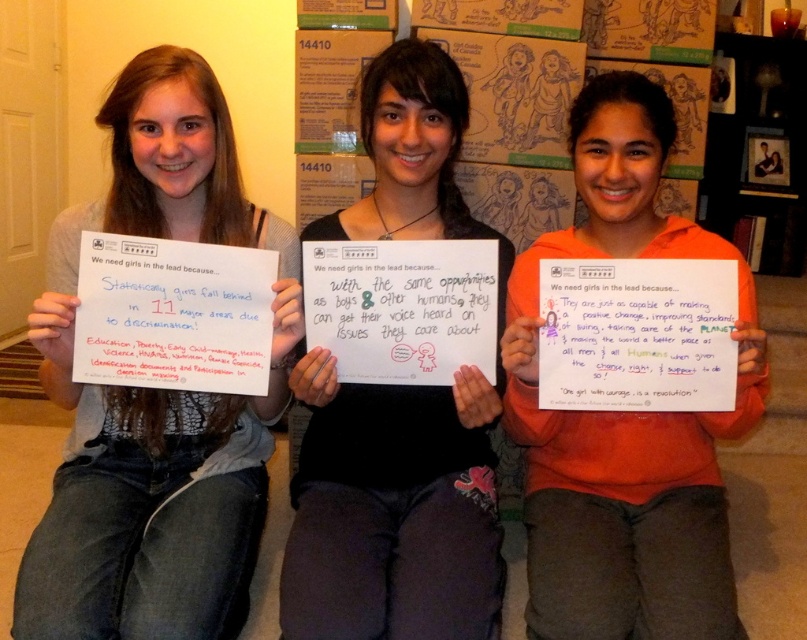
Question: Is white paper at center thinner than orange cotton shirt at center?

Choices:
 (A) yes
 (B) no

Answer: (A)

Question: Which point is closer to the camera?

Choices:
 (A) (534, 561)
 (B) (42, 307)

Answer: (B)

Question: Does gray sweater at center appear over white paper at center?

Choices:
 (A) yes
 (B) no

Answer: (B)

Question: Which object is positioned closest to the gray sweater at center?

Choices:
 (A) white paper at center
 (B) orange cotton shirt at center

Answer: (A)

Question: Does gray sweater at center lie in front of orange cotton shirt at center?

Choices:
 (A) no
 (B) yes

Answer: (B)

Question: Which is farther from the orange cotton shirt at center?

Choices:
 (A) gray sweater at center
 (B) white paper at center

Answer: (A)